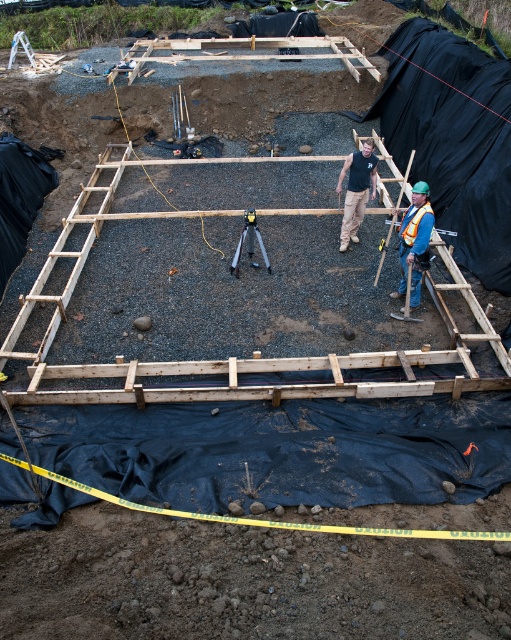
You are a safety inspector at the construction site. You notice two workers wearing a blue reflective vest at center and a black tank top at center. Which worker is shorter?

The blue reflective vest at center has a lesser height compared to the black tank top at center, so the worker in the blue reflective vest at center is shorter.

You are a safety inspector visiting a construction site. You notice the blue reflective vest at center and the metallic tripod at center. Which object is taller when viewed from above?

The blue reflective vest at center is taller than the metallic tripod at center.

You are a construction worker who needs to place a new tool on the ground. You have a tool that is 12 inches wide. There is a black tank top at center and a metallic tripod at center. Which object can the tool fit next to without overlapping?

The tool that is 12 inches wide can fit next to the black tank top at center because it is thinner than the metallic tripod at center.